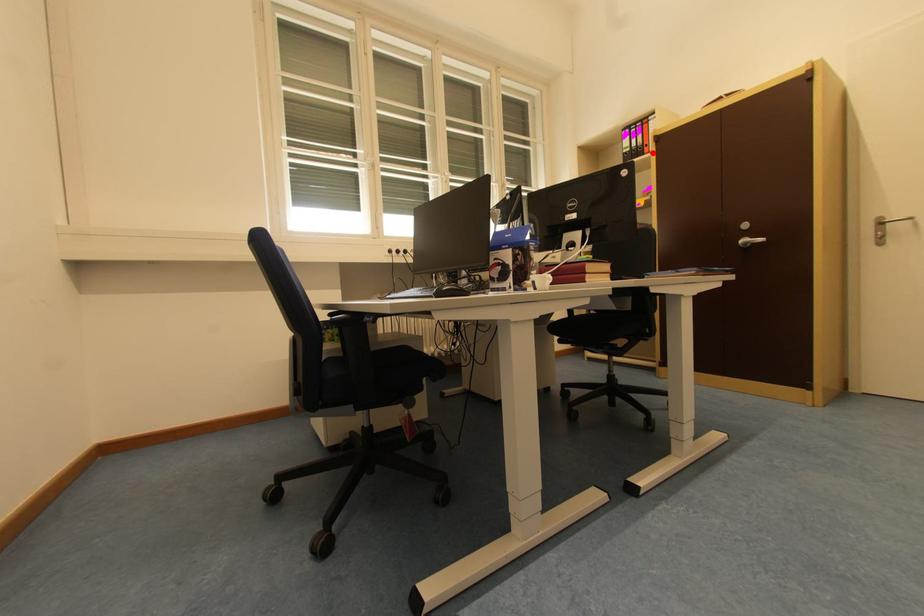
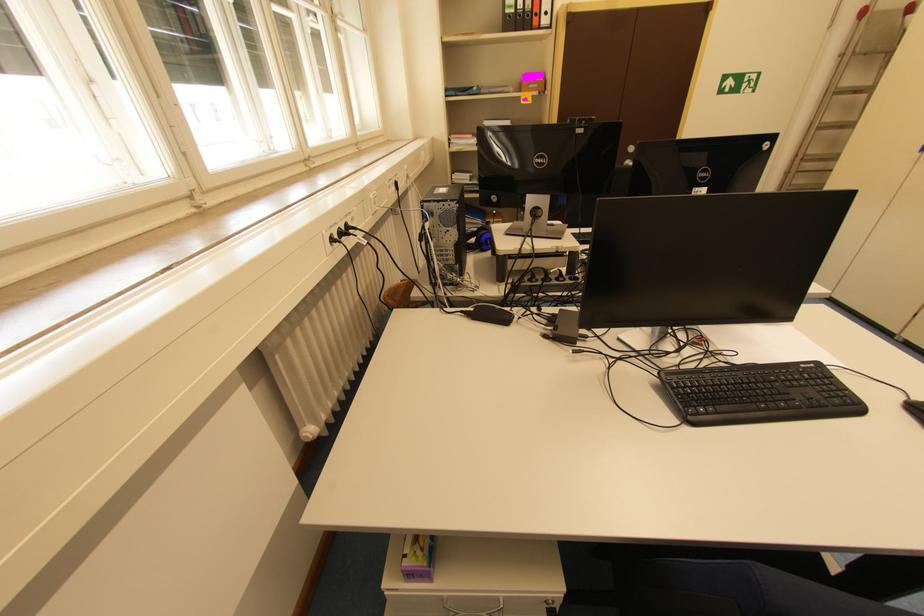
Where in the second image is the point corresponding to the highlighted location from the first image?

(541, 25)